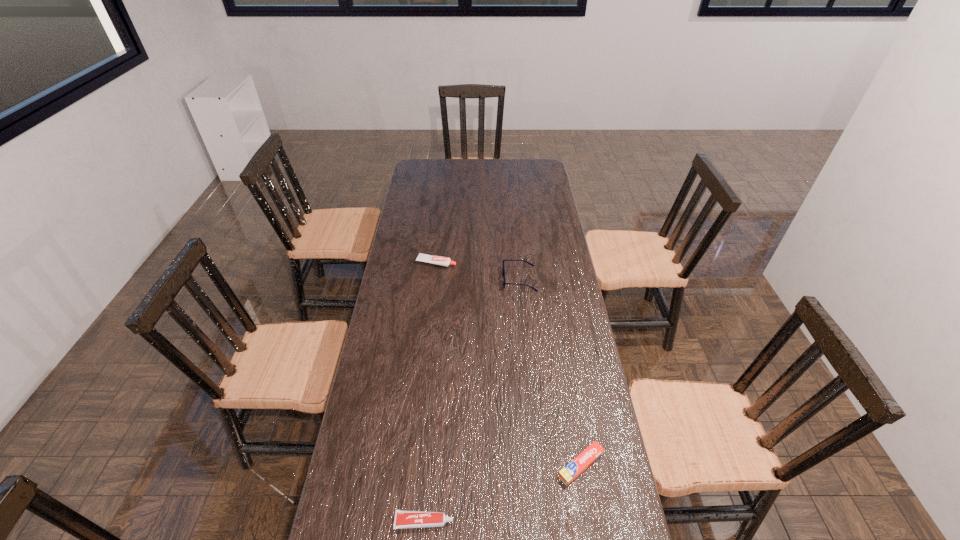
Where is `free space between the second nearest object and the nearest object`? free space between the second nearest object and the nearest object is located at coordinates (502, 493).

Find the location of `free spot between the nearest object and the second farthest toothpaste`. free spot between the nearest object and the second farthest toothpaste is located at coordinates (502, 493).

Locate an element on the screen. empty space between the farthest toothpaste and the rightmost toothpaste is located at coordinates (509, 363).

Find the location of a particular element. This screenshot has height=540, width=960. vacant area that lies between the spectacles and the second tallest object is located at coordinates (478, 271).

Where is `free space between the spectacles and the rightmost toothpaste`? The image size is (960, 540). free space between the spectacles and the rightmost toothpaste is located at coordinates (550, 372).

Locate an element on the screen. vacant area between the rightmost toothpaste and the second tallest object is located at coordinates (509, 363).

Image resolution: width=960 pixels, height=540 pixels. Identify the location of vacant space that's between the nearest toothpaste and the second nearest toothpaste. (502, 493).

The height and width of the screenshot is (540, 960). Identify the location of vacant region between the rightmost toothpaste and the tallest toothpaste. (509, 363).

Identify the location of free space between the rightmost toothpaste and the nearest toothpaste. This screenshot has width=960, height=540. [x=502, y=493].

Locate which object ranks in proximity to the second farthest toothpaste. Please provide its 2D coordinates. Your answer should be formatted as a tuple, i.e. [(x, y)], where the tuple contains the x and y coordinates of a point satisfying the conditions above.

[(403, 519)]